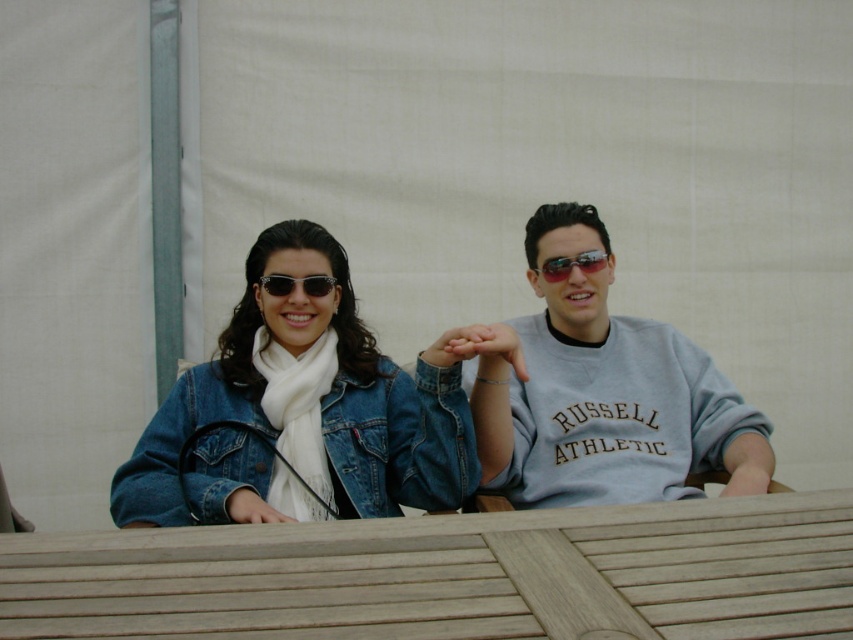
Is point (221, 410) positioned after point (326, 275)?

That is False.

Is denim jacket at center smaller than matte black sunglasses at center?

No.

The image size is (853, 640). I want to click on denim jacket at center, so click(318, 401).

Who is shorter, sunglasses at center or matte black sunglasses at center?

With less height is matte black sunglasses at center.

Is sunglasses at center in front of matte black sunglasses at center?

No.

Image resolution: width=853 pixels, height=640 pixels. In order to click on sunglasses at center in this screenshot , I will do `click(572, 264)`.

Between point (488, 394) and point (317, 282), which one is positioned in front?

Point (488, 394) is in front.

Is matte gray sweatshirt at center wider than matte black sunglasses at center?

Yes, matte gray sweatshirt at center is wider than matte black sunglasses at center.

Does point (663, 474) lie behind point (312, 282)?

Yes, point (663, 474) is behind point (312, 282).

The image size is (853, 640). Find the location of `matte gray sweatshirt at center`. matte gray sweatshirt at center is located at coordinates (602, 394).